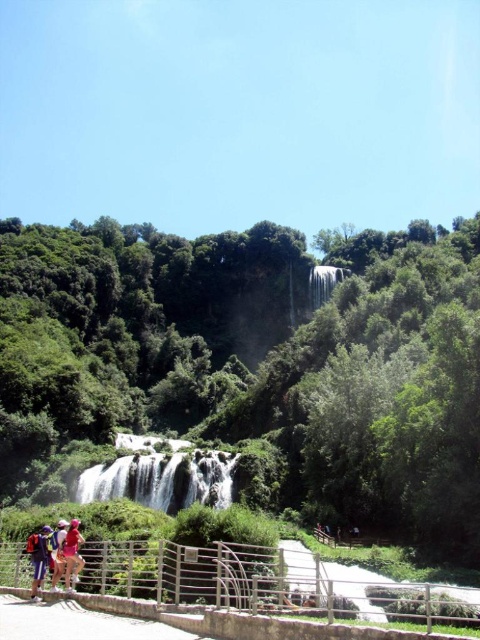
You are standing at the viewpoint overlooking the waterfalls and notice a pair of matte purple shorts at lower left. If you want to take a closer look at them, would you need to walk towards or away from the cascading waterfalls?

The matte purple shorts at lower left is 100.32 feet away from viewer. To get closer to them, you would need to walk towards the cascading waterfalls since the shorts are located in the foreground near the pathway.

You are a tour guide leading a group along the pathway. You need to ensure that all visitors maintain a minimum distance of 2 meters apart for safety. Are the matte purple shorts at lower left and the matte pink shirt at lower left complying with this requirement?

The distance between the matte purple shorts at lower left and the matte pink shirt at lower left is 1.80 meters, which is less than the required 2 meters. Therefore, they are not complying with the safety requirement.

You are standing on the paved pathway with the matte purple shorts at lower left. Looking towards the white frothy water at center, is it located to your left or right side?

The white frothy water at center is to the right of the matte purple shorts at lower left, so it is located to your right side.